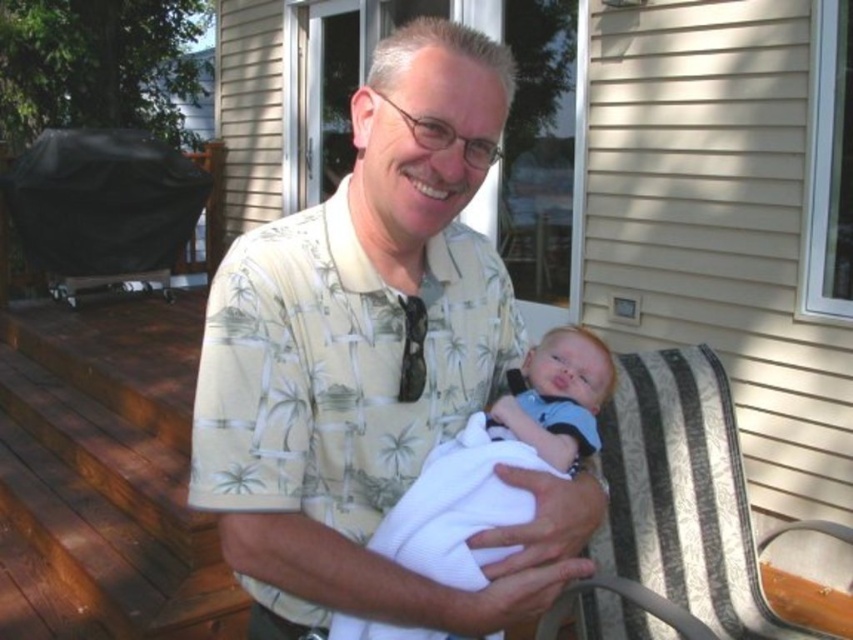
Question: Is white clothed baby at center wider than matte black tie at center?

Choices:
 (A) no
 (B) yes

Answer: (B)

Question: Which object appears closest to the camera in this image?

Choices:
 (A) patterned fabric rocking chair at right
 (B) brown wood deck at lower left

Answer: (A)

Question: Is the position of brown wood deck at lower left less distant than that of matte black tie at center?

Choices:
 (A) yes
 (B) no

Answer: (B)

Question: Can you confirm if yellow printed shirt at center is positioned below brown wood deck at lower left?

Choices:
 (A) yes
 (B) no

Answer: (B)

Question: Considering the real-world distances, which object is farthest from the yellow printed shirt at center?

Choices:
 (A) patterned fabric rocking chair at right
 (B) white clothed baby at center
 (C) matte black tie at center
 (D) brown wood deck at lower left

Answer: (D)

Question: Which point is closer to the camera taking this photo?

Choices:
 (A) (376, 284)
 (B) (737, 616)

Answer: (A)